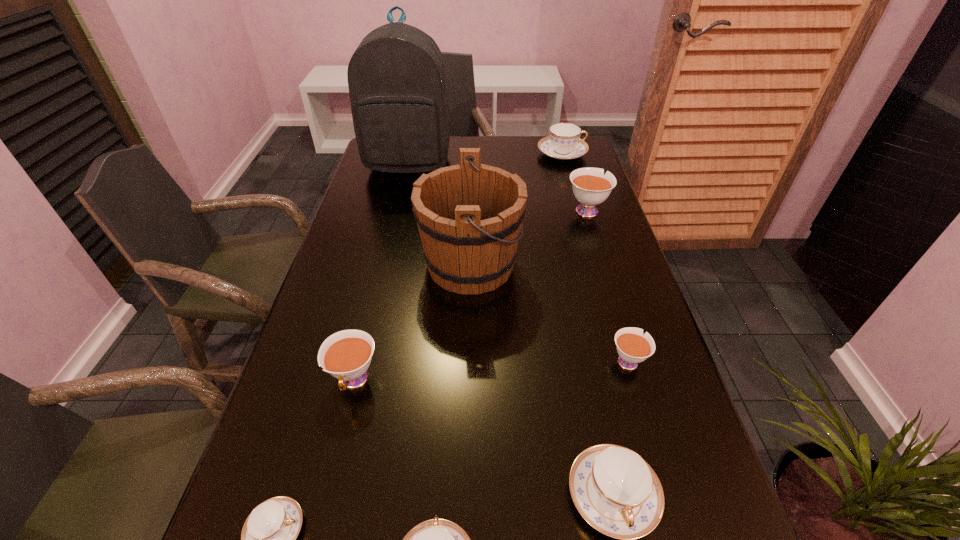
Where is `free space that satisfies the following two spatial constraints: 1. on the side with the handle of the biggest blue teacup; 2. on the side of the farthest white teacup with the handle`? The height and width of the screenshot is (540, 960). free space that satisfies the following two spatial constraints: 1. on the side with the handle of the biggest blue teacup; 2. on the side of the farthest white teacup with the handle is located at coordinates (578, 210).

Where is `free space that satisfies the following two spatial constraints: 1. on the side of the wine bucket with the handle for carrying; 2. on the side of the leftmost white teacup with the handle`? free space that satisfies the following two spatial constraints: 1. on the side of the wine bucket with the handle for carrying; 2. on the side of the leftmost white teacup with the handle is located at coordinates (468, 381).